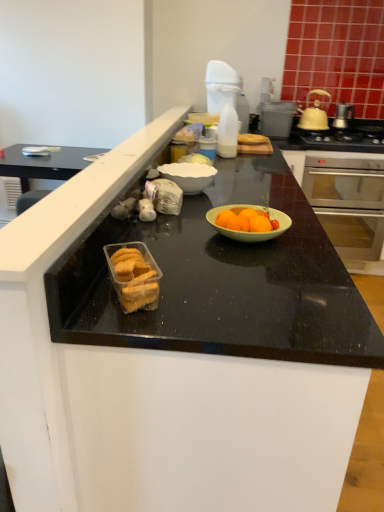
Question: Considering the positions of point (125, 244) and point (347, 113), is point (125, 244) closer or farther from the camera than point (347, 113)?

Choices:
 (A) closer
 (B) farther

Answer: (A)

Question: Relative to silver metallic pot at upper right, acting as the 2th pot/pan starting from the left, is translucent plastic container of cookies at center in front or behind?

Choices:
 (A) front
 (B) behind

Answer: (A)

Question: Estimate the real-world distances between objects in this image. Which object is closer to the metallic gray toaster at upper right?

Choices:
 (A) white plastic spray bottle at upper center
 (B) translucent plastic bottle at upper center
 (C) black granite counter top at center
 (D) stainless steel oven at right
 (E) translucent plastic container of cookies at center

Answer: (A)

Question: Estimate the real-world distances between objects in this image. Which object is farther from the translucent plastic container of cookies at center?

Choices:
 (A) black granite counter top at center
 (B) stainless steel oven at right
 (C) translucent plastic bottle at upper center
 (D) yellow matte pot at upper right, arranged as the second pot/pan when viewed from the right
 (E) metallic silver gas stove at upper right

Answer: (D)